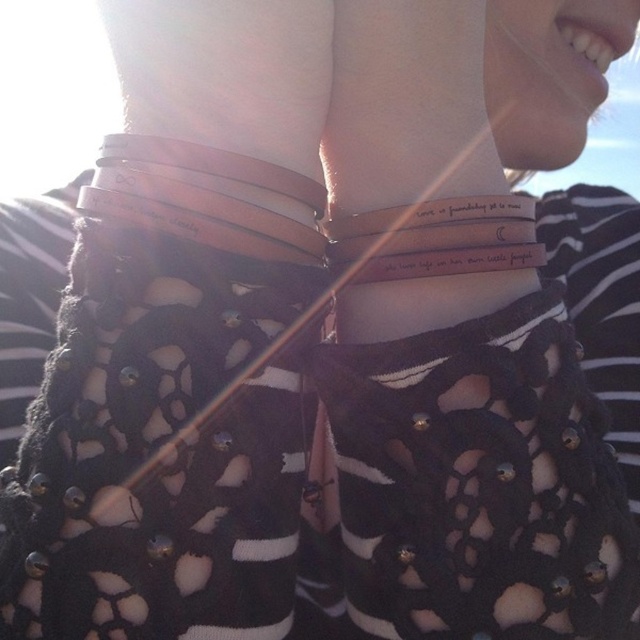
Question: Among these objects, which one is nearest to the camera?

Choices:
 (A) brown leather bracelets at center
 (B) white leather bracelet at center

Answer: (A)

Question: Can you confirm if brown leather bracelets at center is thinner than white leather bracelet at center?

Choices:
 (A) yes
 (B) no

Answer: (B)

Question: Which object is closer to the camera taking this photo?

Choices:
 (A) brown leather bracelets at center
 (B) white leather bracelet at center

Answer: (A)

Question: Is brown leather bracelets at center positioned behind white leather bracelet at center?

Choices:
 (A) no
 (B) yes

Answer: (A)

Question: Is brown leather bracelets at center to the left of white leather bracelet at center from the viewer's perspective?

Choices:
 (A) no
 (B) yes

Answer: (A)